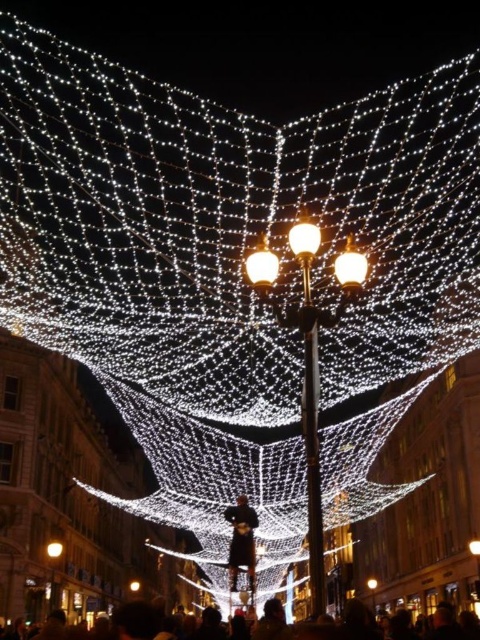
Can you confirm if matte glass streetlight at center is positioned below illuminated wire mesh at center?

No.

Who is more forward, (299, 236) or (54, 552)?

Point (299, 236) is in front.

Is point (304, 221) closer to viewer compared to point (60, 552)?

Yes.

You are a GUI agent. You are given a task and a screenshot of the screen. Output one action in this format:
    pyautogui.click(x=<x>, y=<y>)
    Task: Click on the matte glass streetlight at center
    
    Given the screenshot: What is the action you would take?
    pyautogui.click(x=303, y=237)

Who is taller, white glossy streetlight at center or matte glass streetlight at center?

white glossy streetlight at center is taller.

Who is more distant from viewer, (346, 260) or (295, 248)?

The point (346, 260) is more distant.

Identify the location of white glossy streetlight at center. The image size is (480, 640). (350, 266).

In order to click on white glossy streetlight at center in this screenshot , I will do `click(350, 266)`.

Which of these two, matte gold streetlight at center or illuminated wire mesh at center, stands shorter?

illuminated wire mesh at center is shorter.

Measure the distance between matte gold streetlight at center and camera.

A distance of 118.53 meters exists between matte gold streetlight at center and camera.

The image size is (480, 640). I want to click on matte gold streetlight at center, so click(52, 572).